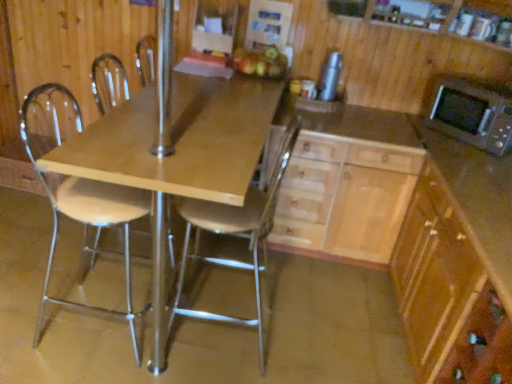
You are a GUI agent. You are given a task and a screenshot of the screen. Output one action in this format:
    pyautogui.click(x=<x>, y=<y>)
    Task: Click on the blank space to the left of white plastic chair at left, the second chair viewed from the right
    The width and height of the screenshot is (512, 384).
    Given the screenshot: What is the action you would take?
    pyautogui.click(x=36, y=301)